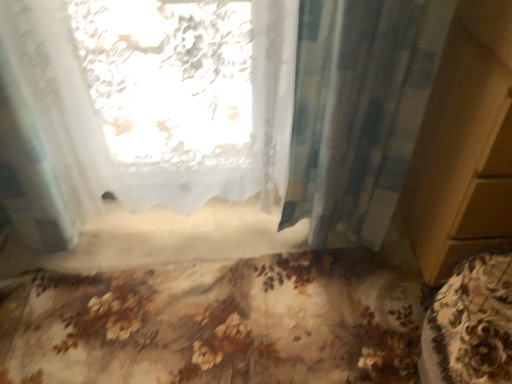
The image size is (512, 384). I want to click on vacant space underneath fluffy carpet at lower center (from a real-world perspective), so click(213, 325).